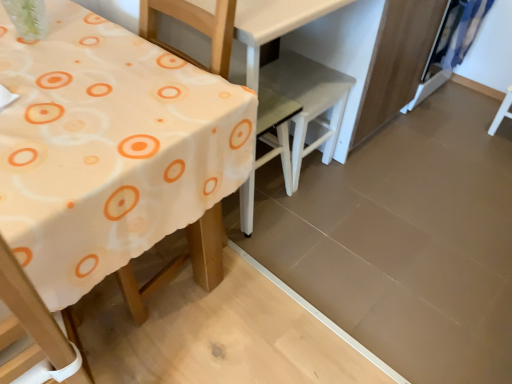
Question: Does white fabric table at left have a smaller size compared to white plastic chair at center, the second chair when ordered from left to right?

Choices:
 (A) no
 (B) yes

Answer: (A)

Question: Is white fabric table at left oriented towards white plastic chair at center, the second chair when ordered from left to right?

Choices:
 (A) no
 (B) yes

Answer: (A)

Question: Is white fabric table at left closer to the viewer compared to white plastic chair at center, the first chair in the right-to-left sequence?

Choices:
 (A) no
 (B) yes

Answer: (B)

Question: From the image's perspective, does white fabric table at left appear higher than white plastic chair at center, the first chair in the right-to-left sequence?

Choices:
 (A) yes
 (B) no

Answer: (B)

Question: Is white fabric table at left taller than white plastic chair at center, the second chair when ordered from left to right?

Choices:
 (A) yes
 (B) no

Answer: (A)

Question: Is white fabric table at left thinner than white plastic chair at center, the second chair when ordered from left to right?

Choices:
 (A) no
 (B) yes

Answer: (A)

Question: Does white plastic chair at center, the second chair when ordered from left to right, come behind blue fabric curtain at upper right?

Choices:
 (A) no
 (B) yes

Answer: (A)

Question: Is white plastic chair at center, the second chair when ordered from left to right, looking in the opposite direction of blue fabric curtain at upper right?

Choices:
 (A) yes
 (B) no

Answer: (B)

Question: Considering the relative sizes of white plastic chair at center, the first chair in the right-to-left sequence, and blue fabric curtain at upper right in the image provided, is white plastic chair at center, the first chair in the right-to-left sequence, shorter than blue fabric curtain at upper right?

Choices:
 (A) no
 (B) yes

Answer: (B)

Question: Is white plastic chair at center, the second chair when ordered from left to right, closer to camera compared to blue fabric curtain at upper right?

Choices:
 (A) no
 (B) yes

Answer: (B)

Question: From a real-world perspective, is white plastic chair at center, the second chair when ordered from left to right, located higher than blue fabric curtain at upper right?

Choices:
 (A) no
 (B) yes

Answer: (A)

Question: From the image's perspective, is white plastic chair at center, the second chair when ordered from left to right, on blue fabric curtain at upper right?

Choices:
 (A) yes
 (B) no

Answer: (B)

Question: Is white plastic chair at center, the second chair when ordered from left to right, completely or partially inside blue fabric curtain at upper right?

Choices:
 (A) yes
 (B) no

Answer: (B)